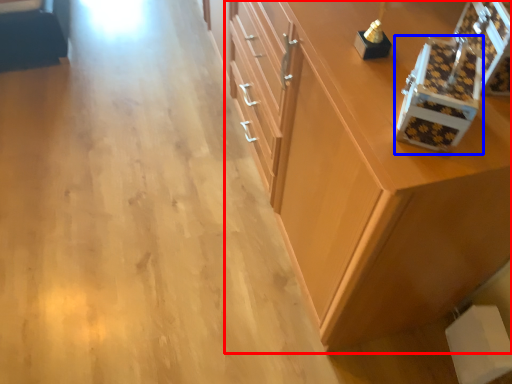
Question: Which object appears closest to the camera in this image, cabinetry (highlighted by a red box) or box (highlighted by a blue box)?

Choices:
 (A) cabinetry
 (B) box

Answer: (B)